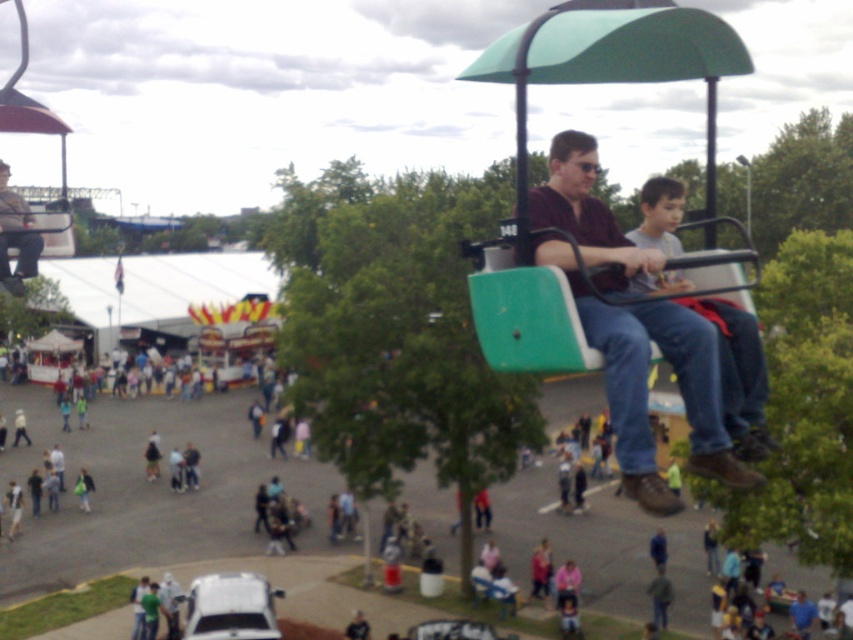
Question: Which point is farther from the camera taking this photo?

Choices:
 (A) (15, 236)
 (B) (711, 404)

Answer: (A)

Question: Can you confirm if matte brown shirt at center is positioned above matte black jacket at upper center?

Choices:
 (A) yes
 (B) no

Answer: (B)

Question: Can you confirm if matte brown shirt at center is thinner than matte black jacket at upper center?

Choices:
 (A) no
 (B) yes

Answer: (A)

Question: Observing the image, what is the correct spatial positioning of matte brown shirt at center in reference to matte black jacket at upper center?

Choices:
 (A) below
 (B) above

Answer: (A)